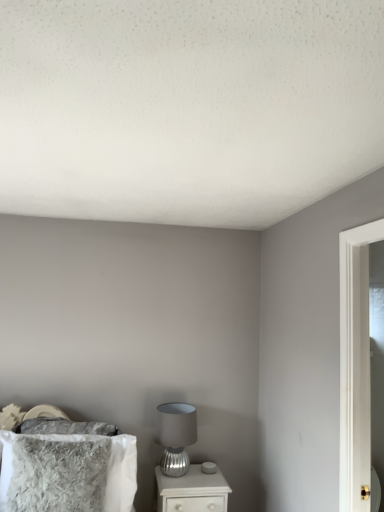
Question: Considering the relative sizes of satin silver table lamp at lower center and fuzzy gray pillow at lower left in the image provided, is satin silver table lamp at lower center shorter than fuzzy gray pillow at lower left?

Choices:
 (A) yes
 (B) no

Answer: (A)

Question: From the image's perspective, is satin silver table lamp at lower center located beneath fuzzy gray pillow at lower left?

Choices:
 (A) no
 (B) yes

Answer: (B)

Question: Is satin silver table lamp at lower center surrounding fuzzy gray pillow at lower left?

Choices:
 (A) yes
 (B) no

Answer: (B)

Question: Is satin silver table lamp at lower center far from fuzzy gray pillow at lower left?

Choices:
 (A) no
 (B) yes

Answer: (A)

Question: Is satin silver table lamp at lower center wider than fuzzy gray pillow at lower left?

Choices:
 (A) yes
 (B) no

Answer: (A)

Question: Could you tell me if satin silver table lamp at lower center is turned towards fuzzy gray pillow at lower left?

Choices:
 (A) no
 (B) yes

Answer: (A)

Question: Considering the relative positions of fuzzy gray pillow at lower left and white glossy nightstand at lower center in the image provided, is fuzzy gray pillow at lower left to the left of white glossy nightstand at lower center from the viewer's perspective?

Choices:
 (A) no
 (B) yes

Answer: (B)

Question: Does fuzzy gray pillow at lower left turn towards white glossy nightstand at lower center?

Choices:
 (A) yes
 (B) no

Answer: (B)

Question: Is fuzzy gray pillow at lower left far from white glossy nightstand at lower center?

Choices:
 (A) yes
 (B) no

Answer: (B)

Question: Is fuzzy gray pillow at lower left turned away from white glossy nightstand at lower center?

Choices:
 (A) no
 (B) yes

Answer: (A)

Question: From a real-world perspective, is fuzzy gray pillow at lower left positioned over white glossy nightstand at lower center based on gravity?

Choices:
 (A) yes
 (B) no

Answer: (A)

Question: Is the position of fuzzy gray pillow at lower left less distant than that of white glossy nightstand at lower center?

Choices:
 (A) yes
 (B) no

Answer: (A)

Question: Is fuzzy gray pillow at lower left completely or partially inside white glossy nightstand at lower center?

Choices:
 (A) yes
 (B) no

Answer: (B)